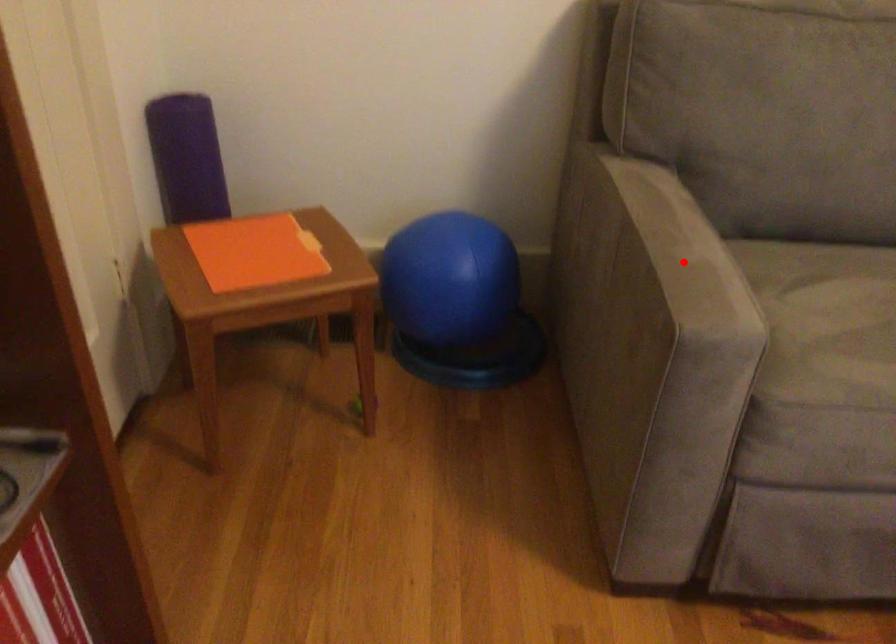
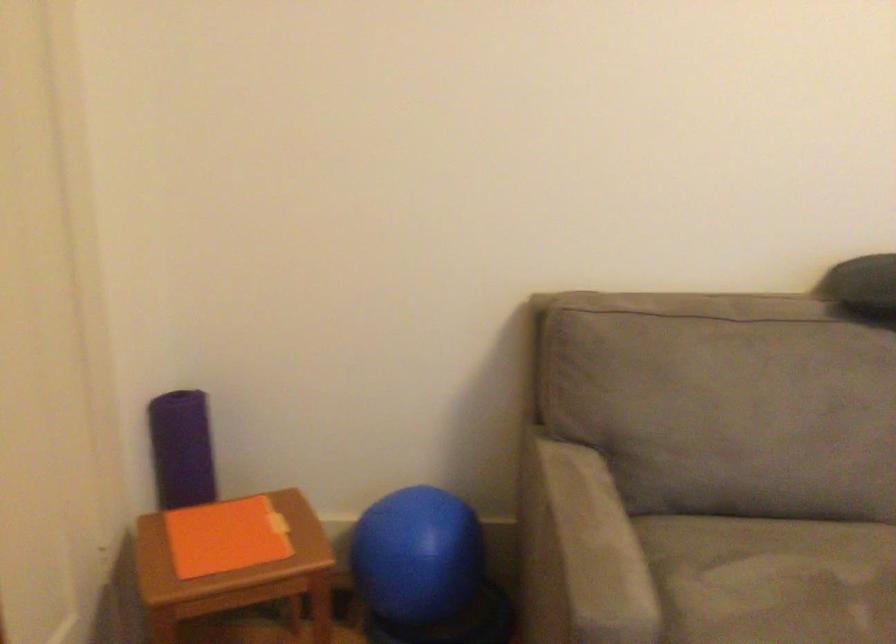
Question: I am providing you with two images of the same scene from different viewpoints. Given a red point in image1, look at the same physical point in image2. Is it:

Choices:
 (A) Closer to the viewpoint
 (B) Farther from the viewpoint

Answer: (B)